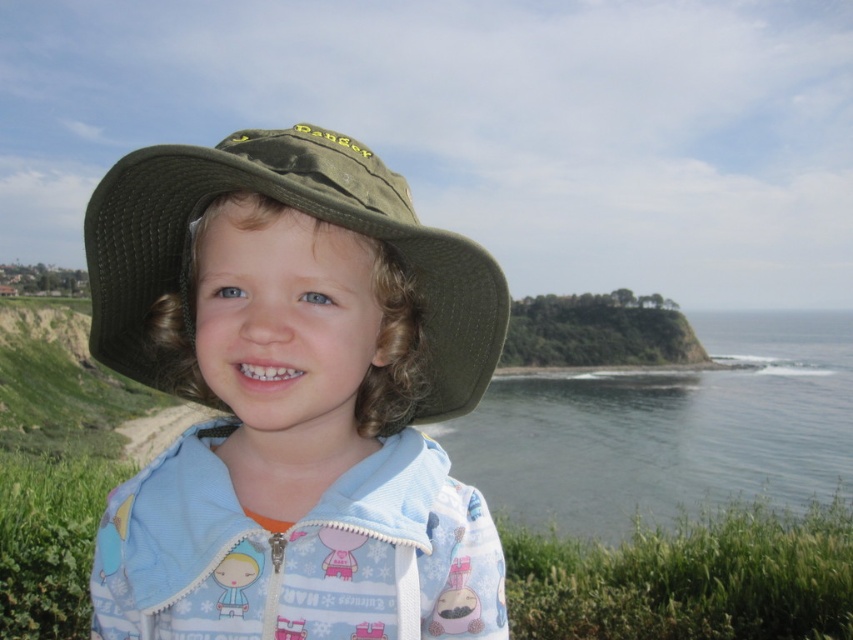
Is green fabric hat at center to the left of green leafy cliff at center from the viewer's perspective?

Correct, you'll find green fabric hat at center to the left of green leafy cliff at center.

Describe the element at coordinates (300, 211) in the screenshot. Image resolution: width=853 pixels, height=640 pixels. I see `green fabric hat at center` at that location.

This screenshot has height=640, width=853. I want to click on green fabric hat at center, so click(300, 211).

Which is behind, point (680, 499) or point (503, 308)?

The point (680, 499) is more distant.

Describe the element at coordinates (666, 429) in the screenshot. I see `clear blue water at lower right` at that location.

At what (x,y) coordinates should I click in order to perform the action: click on clear blue water at lower right. Please return your answer as a coordinate pair (x, y). Looking at the image, I should click on (666, 429).

Does clear blue water at lower right have a lesser width compared to green leafy cliff at center?

Incorrect, clear blue water at lower right's width is not less than green leafy cliff at center's.

Can you confirm if clear blue water at lower right is positioned to the right of green leafy cliff at center?

Indeed, clear blue water at lower right is positioned on the right side of green leafy cliff at center.

I want to click on clear blue water at lower right, so click(666, 429).